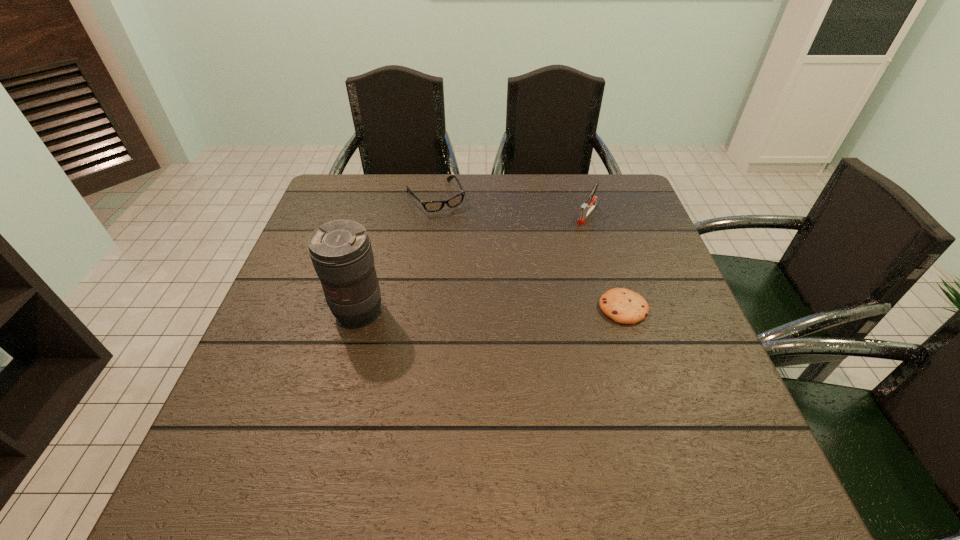
The width and height of the screenshot is (960, 540). In order to click on vacant space on the desktop that is between the tallest object and the shortest object and is positioned on the front-facing side of the spectacles in this screenshot , I will do `click(511, 309)`.

Locate an element on the screen. This screenshot has height=540, width=960. free space on the desktop that is between the telephoto lens and the shortest object and is positioned on the handle side of the stapler is located at coordinates (508, 309).